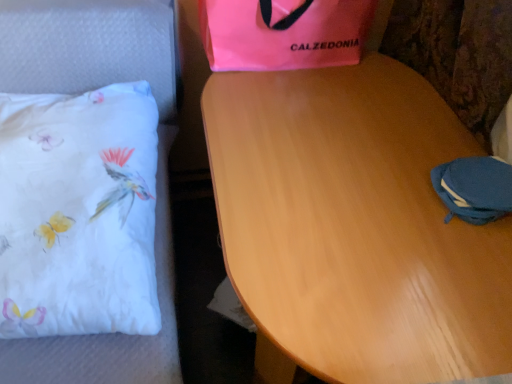
Question: Relative to light brown wood table at center, is blue fabric pouch at lower right in front or behind?

Choices:
 (A) behind
 (B) front

Answer: (A)

Question: Would you say blue fabric pouch at lower right is inside or outside light brown wood table at center?

Choices:
 (A) outside
 (B) inside

Answer: (B)

Question: Based on their relative distances, which object is nearer to the pink fabric bag at upper center?

Choices:
 (A) blue fabric pouch at lower right
 (B) white fabric pillow at left
 (C) light brown wood table at center

Answer: (C)

Question: Which is nearer to the white fabric pillow at left?

Choices:
 (A) pink fabric bag at upper center
 (B) blue fabric pouch at lower right
 (C) light brown wood table at center

Answer: (A)